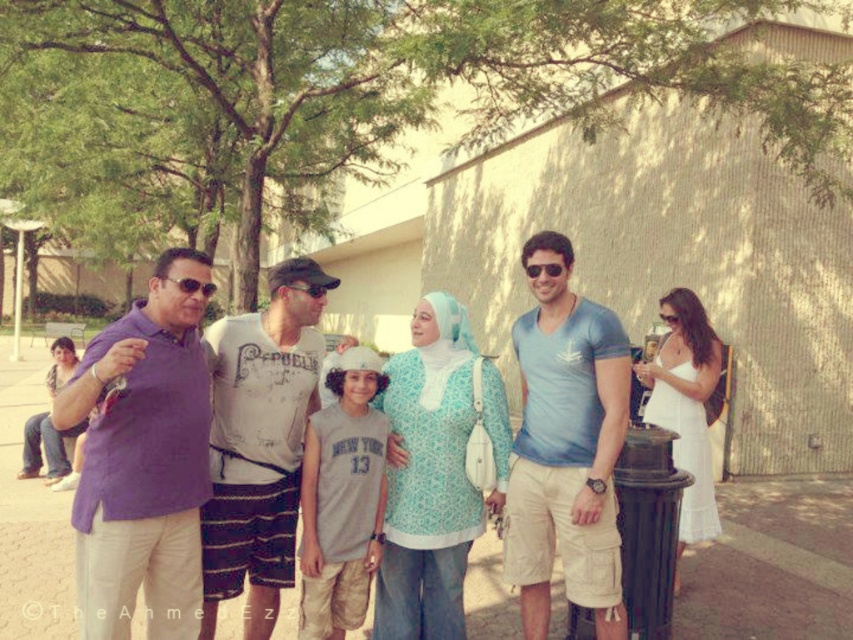
From the picture: You are a photographer trying to capture a photo of the purple cotton shirt at left and the transparent plastic goggles at center. Which object should you focus on first if you want to ensure both are in focus, given their height difference?

The purple cotton shirt at left is much taller than the transparent plastic goggles at center, so you should focus on the purple cotton shirt at left first to ensure both are in focus.

You are standing in the park and want to take a photo of both the point at [123,465] and the point at [204,296]. Which point should you focus on first to ensure both are in focus?

You should focus on the point at [204,296] first because it is farther from the camera than the point at [123,465], ensuring both will be in focus when using depth of field.

Where is the purple cotton shirt at left located in the image?

The purple cotton shirt at left is located at point (142,460) in the image.